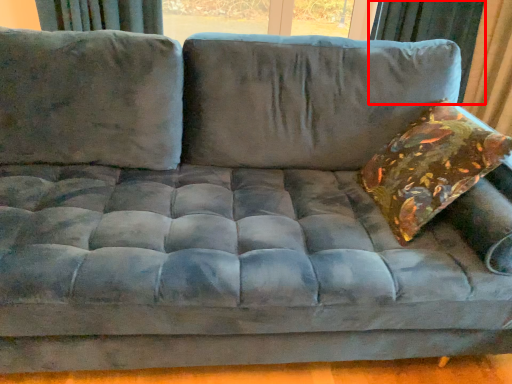
Question: From the image's perspective, what is the correct spatial relationship of curtain (annotated by the red box) in relation to throw pillow?

Choices:
 (A) above
 (B) below

Answer: (A)